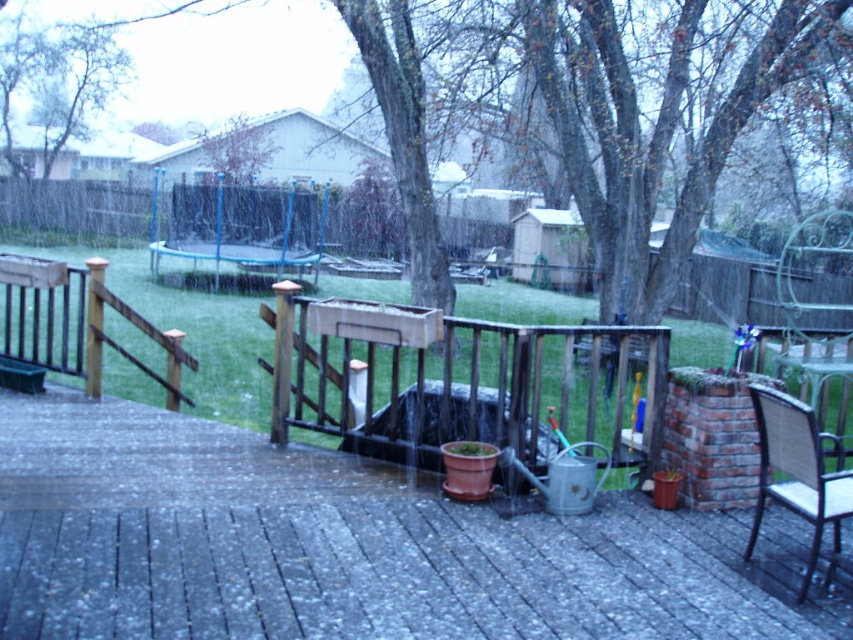
Image resolution: width=853 pixels, height=640 pixels. What do you see at coordinates (347, 545) in the screenshot? I see `smooth concrete deck at center` at bounding box center [347, 545].

Is smooth concrete deck at center taller than woven wicker chair at lower right?

No.

Does point (135, 536) come behind point (804, 492)?

That is False.

You are a GUI agent. You are given a task and a screenshot of the screen. Output one action in this format:
    pyautogui.click(x=<x>, y=<y>)
    Task: Click on the smooth concrete deck at center
    
    Given the screenshot: What is the action you would take?
    pyautogui.click(x=347, y=545)